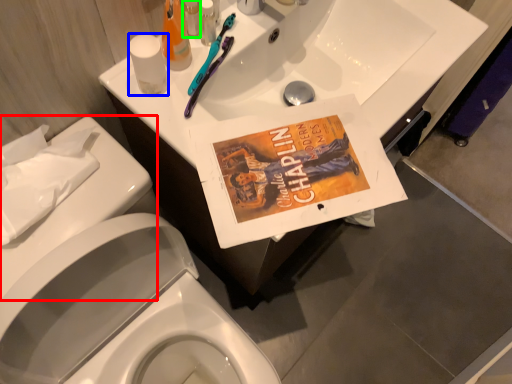
Question: Estimate the real-world distances between objects in this image. Which object is closer to porcelain (highlighted by a red box), toilet paper (highlighted by a blue box) or toiletry (highlighted by a green box)?

Choices:
 (A) toilet paper
 (B) toiletry

Answer: (A)